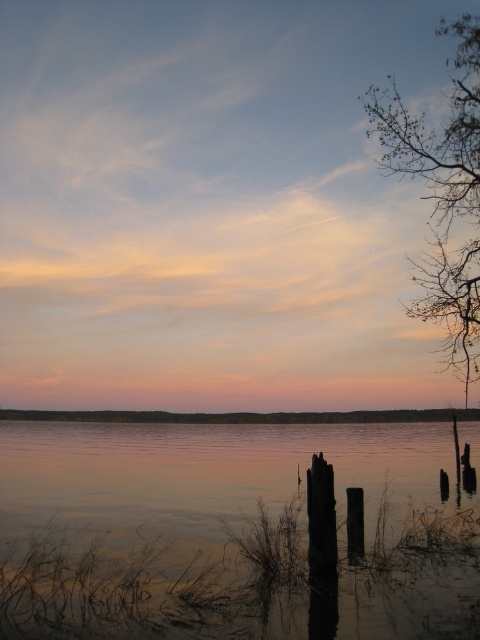
In the scene shown: You are an artist trying to paint the lakeside scene. You want to place the reflection of the bare branches at upper right in your painting. Where should you position it relative to the smooth reflective water at center?

The smooth reflective water at center is to the left of the bare branches at upper right, so you should position the reflection of the bare branches at upper right to the right side of the smooth reflective water at center in your painting.

Based on the coordinates provided, what is the main feature located at point (233, 531) in the image?

The point (233, 531) corresponds to smooth reflective water at center.